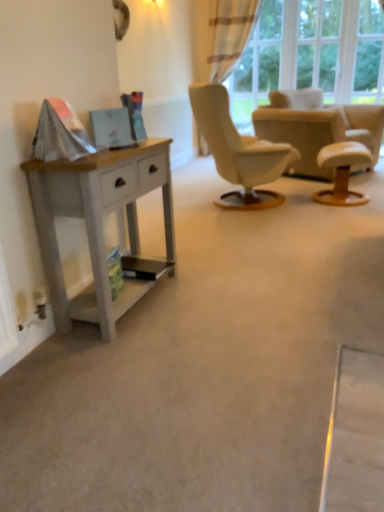
Where is `vacant area situated below white leather stool at right (from a real-world perspective)`? The height and width of the screenshot is (512, 384). vacant area situated below white leather stool at right (from a real-world perspective) is located at coordinates (339, 203).